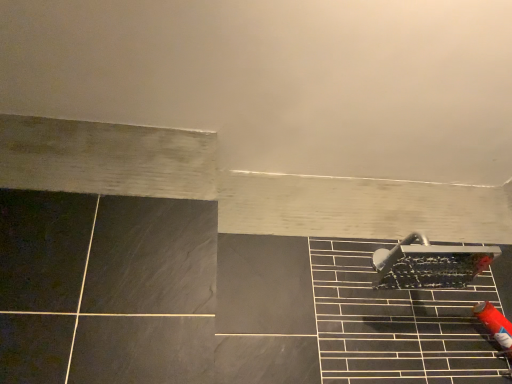
This screenshot has height=384, width=512. What do you see at coordinates (430, 264) in the screenshot?
I see `satin nickel showerhead at lower right` at bounding box center [430, 264].

Image resolution: width=512 pixels, height=384 pixels. What are the coordinates of `satin nickel showerhead at lower right` in the screenshot? It's located at (430, 264).

Describe the element at coordinates (397, 324) in the screenshot. I see `matte black tile at lower right` at that location.

What are the coordinates of `matte black tile at lower right` in the screenshot? It's located at (397, 324).

Where is `satin nickel showerhead at lower right`? The width and height of the screenshot is (512, 384). satin nickel showerhead at lower right is located at coordinates (430, 264).

Which object is positioned more to the left, satin nickel showerhead at lower right or matte black tile at lower right?

From the viewer's perspective, matte black tile at lower right appears more on the left side.

Considering the relative positions of satin nickel showerhead at lower right and matte black tile at lower right in the image provided, is satin nickel showerhead at lower right in front of matte black tile at lower right?

No, satin nickel showerhead at lower right is behind matte black tile at lower right.

Does point (482, 266) appear closer or farther from the camera than point (488, 340)?

Clearly, point (482, 266) is more distant from the camera than point (488, 340).

From the image's perspective, does satin nickel showerhead at lower right appear lower than matte black tile at lower right?

Incorrect, from the image's perspective, satin nickel showerhead at lower right is higher than matte black tile at lower right.

From a real-world perspective, between satin nickel showerhead at lower right and matte black tile at lower right, who is vertically lower?

matte black tile at lower right.

Does satin nickel showerhead at lower right have a greater width compared to matte black tile at lower right?

In fact, satin nickel showerhead at lower right might be narrower than matte black tile at lower right.

Considering the sizes of objects satin nickel showerhead at lower right and matte black tile at lower right in the image provided, who is taller, satin nickel showerhead at lower right or matte black tile at lower right?

matte black tile at lower right is taller.

Who is bigger, satin nickel showerhead at lower right or matte black tile at lower right?

Bigger between the two is matte black tile at lower right.

Is satin nickel showerhead at lower right inside or outside of matte black tile at lower right?

satin nickel showerhead at lower right exists entirely within matte black tile at lower right.

Are satin nickel showerhead at lower right and matte black tile at lower right making contact?

There is a gap between satin nickel showerhead at lower right and matte black tile at lower right.

Is satin nickel showerhead at lower right looking in the opposite direction of matte black tile at lower right?

Yes, satin nickel showerhead at lower right is facing away from matte black tile at lower right.

How different are the orientations of satin nickel showerhead at lower right and matte black tile at lower right in degrees?

The angle between the facing direction of satin nickel showerhead at lower right and the facing direction of matte black tile at lower right is 0.795 degrees.

Where is `shower on the right of the matte black tile at lower right`? shower on the right of the matte black tile at lower right is located at coordinates (430, 264).

Considering the positions of objects matte black tile at lower right and satin nickel showerhead at lower right in the image provided, who is more to the left, matte black tile at lower right or satin nickel showerhead at lower right?

matte black tile at lower right.

In the image, is matte black tile at lower right positioned in front of or behind satin nickel showerhead at lower right?

In the image, matte black tile at lower right appears in front of satin nickel showerhead at lower right.

Is point (344, 349) farther from viewer compared to point (417, 232)?

No, (344, 349) is in front of (417, 232).

From the image's perspective, which is below, matte black tile at lower right or satin nickel showerhead at lower right?

From the image's view, matte black tile at lower right is below.

From a real-world perspective, is matte black tile at lower right physically located above or below satin nickel showerhead at lower right?

matte black tile at lower right is situated lower than satin nickel showerhead at lower right in the real world.

Is matte black tile at lower right thinner than satin nickel showerhead at lower right?

Incorrect, the width of matte black tile at lower right is not less than that of satin nickel showerhead at lower right.

Who is shorter, matte black tile at lower right or satin nickel showerhead at lower right?

satin nickel showerhead at lower right.

Considering the sizes of objects matte black tile at lower right and satin nickel showerhead at lower right in the image provided, who is smaller, matte black tile at lower right or satin nickel showerhead at lower right?

With smaller size is satin nickel showerhead at lower right.

Would you say satin nickel showerhead at lower right is part of matte black tile at lower right's contents?

Absolutely, satin nickel showerhead at lower right is inside matte black tile at lower right.

Can you see matte black tile at lower right touching satin nickel showerhead at lower right?

No, matte black tile at lower right is not making contact with satin nickel showerhead at lower right.

Is matte black tile at lower right positioned with its back to satin nickel showerhead at lower right?

Yes, satin nickel showerhead at lower right is at the back of matte black tile at lower right.

Consider the image. How distant is matte black tile at lower right from satin nickel showerhead at lower right?

A distance of 11.95 centimeters exists between matte black tile at lower right and satin nickel showerhead at lower right.

Identify the location of shower that appears above the matte black tile at lower right (from the image's perspective). This screenshot has height=384, width=512. (430, 264).

Identify the location of shower that appears above the matte black tile at lower right (from a real-world perspective). pyautogui.click(x=430, y=264).

I want to click on shower that is on the right side of matte black tile at lower right, so pos(430,264).